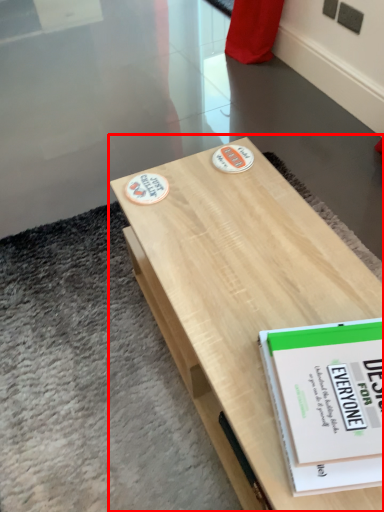
Question: From the image's perspective, what is the correct spatial positioning of table (annotated by the red box) in reference to book?

Choices:
 (A) above
 (B) below

Answer: (A)